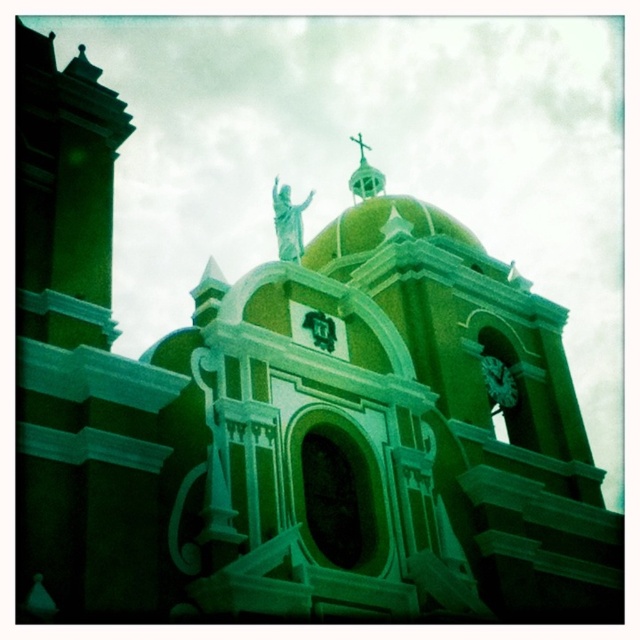
You are standing in front of the church and notice two points marked on its facade. The first point is at coordinate point (296, 225) and the second is at coordinate point (355, 140). Which of these two points is closer to you?

Point (296, 225) is closer to the viewer than point (355, 140).

You are an architect assessing the church design. You notice the green marble statue at upper center and the metallic gold cross at upper center. Which object occupies a larger physical space in the composition?

The green marble statue at upper center is bigger than the metallic gold cross at upper center, so it occupies a larger physical space in the composition.

You are standing in front of the church and notice a point marked at coordinates (x=288, y=221). Based on the scene description, what object is located at this point?

The point at coordinates (x=288, y=221) corresponds to the green marble statue at upper center.